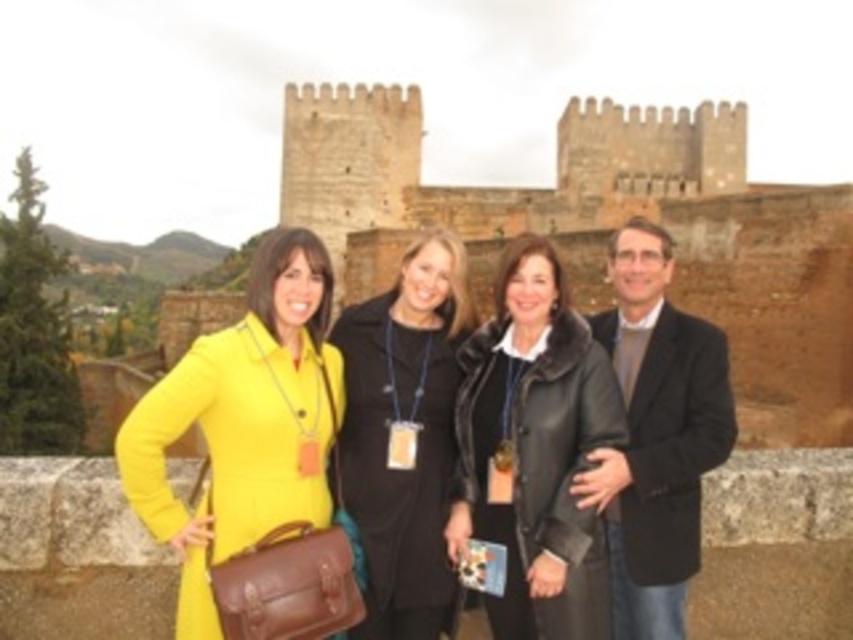
Is point (483, 525) farther from camera compared to point (386, 403)?

No, it is not.

Who is positioned more to the left, black leather coat at center or matte black coat at center?

matte black coat at center is more to the left.

This screenshot has height=640, width=853. Find the location of `black leather coat at center`. black leather coat at center is located at coordinates (535, 449).

Find the location of a particular element. black leather coat at center is located at coordinates (535, 449).

Can you confirm if matte black coat at center is positioned above dark gray wool blazer at center?

Actually, matte black coat at center is below dark gray wool blazer at center.

The width and height of the screenshot is (853, 640). Describe the element at coordinates (404, 433) in the screenshot. I see `matte black coat at center` at that location.

Describe the element at coordinates (404, 433) in the screenshot. I see `matte black coat at center` at that location.

You are a GUI agent. You are given a task and a screenshot of the screen. Output one action in this format:
    pyautogui.click(x=<x>, y=<y>)
    Task: Click on the matte black coat at center
    
    Given the screenshot: What is the action you would take?
    pyautogui.click(x=404, y=433)

Who is higher up, black leather coat at center or dark gray wool blazer at center?

dark gray wool blazer at center is higher up.

Between black leather coat at center and dark gray wool blazer at center, which one is positioned lower?

black leather coat at center is lower down.

Is point (583, 353) positioned after point (664, 532)?

That is True.

The image size is (853, 640). Find the location of `black leather coat at center`. black leather coat at center is located at coordinates 535,449.